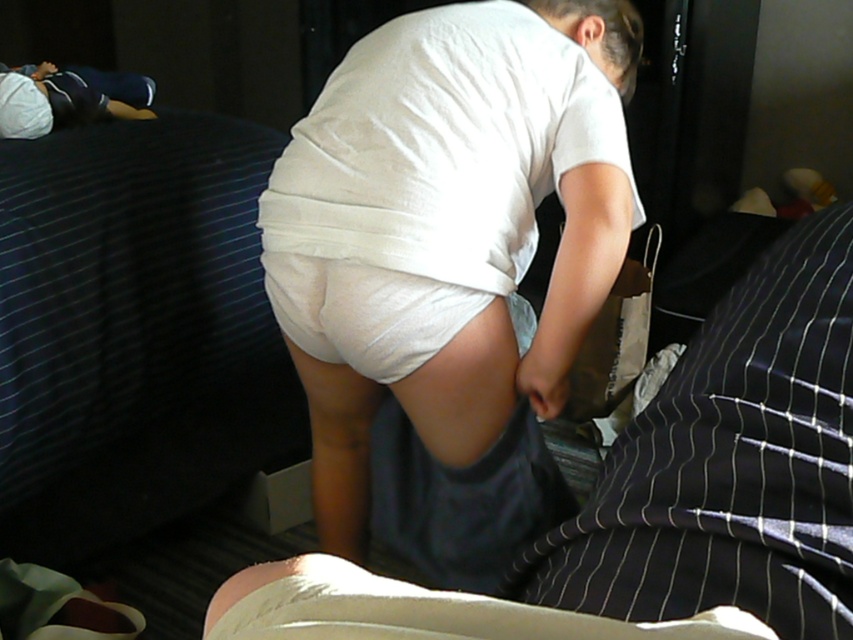
Does white matte shorts at center appear under white cotton shirt at upper left?

Yes, white matte shorts at center is below white cotton shirt at upper left.

Between white matte shorts at center and white cotton shirt at upper left, which one appears on the left side from the viewer's perspective?

Positioned to the left is white cotton shirt at upper left.

Is point (428, 60) positioned in front of point (144, 102)?

Yes, it is in front of point (144, 102).

Where is `white matte shorts at center`? The image size is (853, 640). white matte shorts at center is located at coordinates (450, 260).

Based on the photo, can you confirm if dark blue striped bed at left is taller than white cotton shirt at upper left?

Yes.

Can you confirm if dark blue striped bed at left is positioned to the left of white cotton shirt at upper left?

Incorrect, dark blue striped bed at left is not on the left side of white cotton shirt at upper left.

Where is `dark blue striped bed at left`? This screenshot has height=640, width=853. dark blue striped bed at left is located at coordinates (131, 326).

This screenshot has height=640, width=853. Find the location of `dark blue striped bed at left`. dark blue striped bed at left is located at coordinates coord(131,326).

Who is shorter, white matte shorts at center or dark blue striped bed at left?

With less height is dark blue striped bed at left.

Locate an element on the screen. This screenshot has width=853, height=640. white matte shorts at center is located at coordinates (450, 260).

Find the location of a particular element. The height and width of the screenshot is (640, 853). white matte shorts at center is located at coordinates pos(450,260).